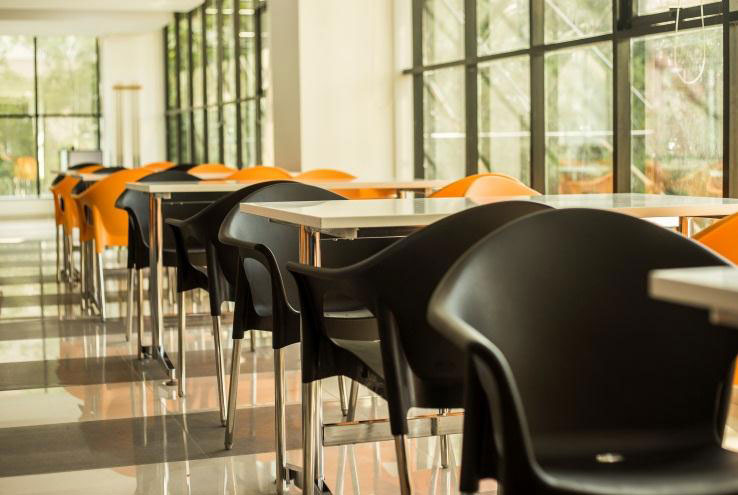
At what (x,y) coordinates should I click in order to perform the action: click on black chairs. Please return your answer as a coordinate pair (x, y). The width and height of the screenshot is (738, 495). Looking at the image, I should click on (601, 277), (458, 237), (248, 228), (210, 222), (128, 211), (83, 180), (77, 163), (184, 162).